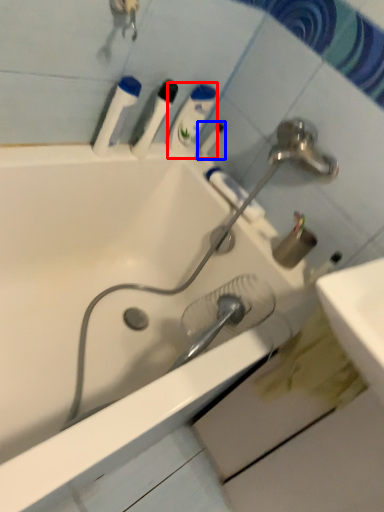
Question: Which of the following is the farthest to the observer, mouthwash (highlighted by a red box) or toothbrush (highlighted by a blue box)?

Choices:
 (A) mouthwash
 (B) toothbrush

Answer: (B)